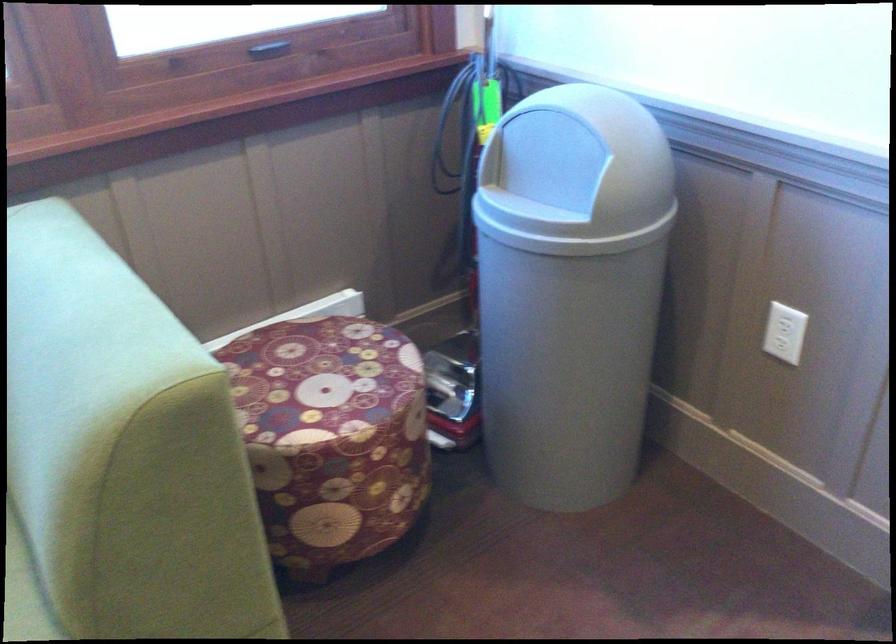
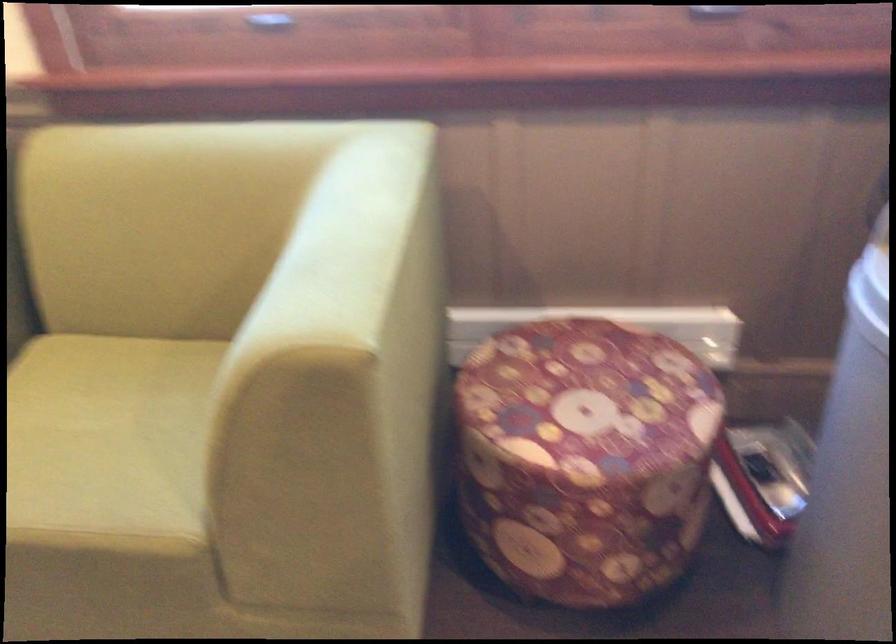
Question: How did the camera likely rotate?

Choices:
 (A) Left
 (B) Right
 (C) Up
 (D) Down

Answer: (A)